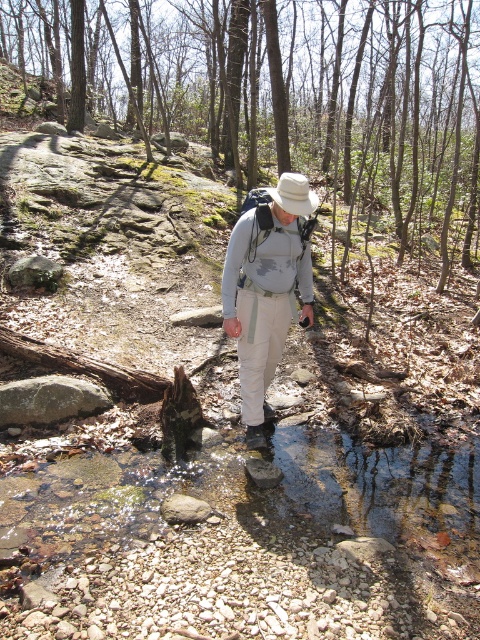
Which is in front, point (280, 186) or point (252, 445)?

Positioned in front is point (280, 186).

I want to click on white fabric hat at center, so click(x=294, y=195).

Identify the location of white fabric hat at center. This screenshot has width=480, height=640. (294, 195).

At what (x,y) coordinates should I click in order to perform the action: click on matte gray shirt at center. Please return your answer as a coordinate pair (x, y). The image size is (480, 640). Looking at the image, I should click on (267, 284).

Consider the image. Between matte gray shirt at center and rubber/muddy hiking boot at center, which one appears on the right side from the viewer's perspective?

Positioned to the right is matte gray shirt at center.

Where is `matte gray shirt at center`? This screenshot has height=640, width=480. matte gray shirt at center is located at coordinates (267, 284).

Locate an element on the screen. matte gray shirt at center is located at coordinates (267, 284).

Can you confirm if matte gray shirt at center is positioned below white fabric hat at center?

Yes, matte gray shirt at center is below white fabric hat at center.

Can you confirm if matte gray shirt at center is taller than white fabric hat at center?

In fact, matte gray shirt at center may be shorter than white fabric hat at center.

Is point (285, 304) more distant than point (280, 198)?

Yes, it is behind point (280, 198).

Where is `matte gray shirt at center`? The width and height of the screenshot is (480, 640). matte gray shirt at center is located at coordinates (267, 284).